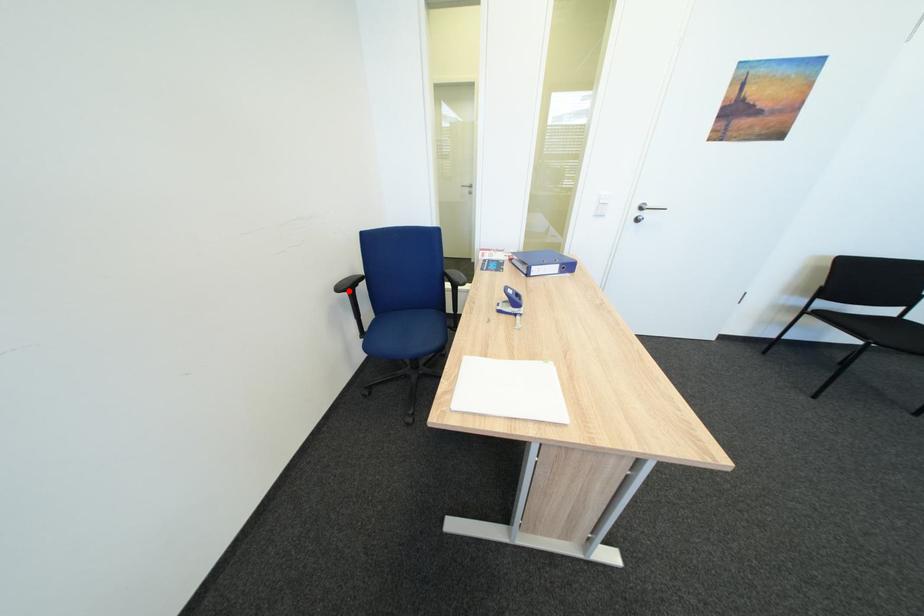
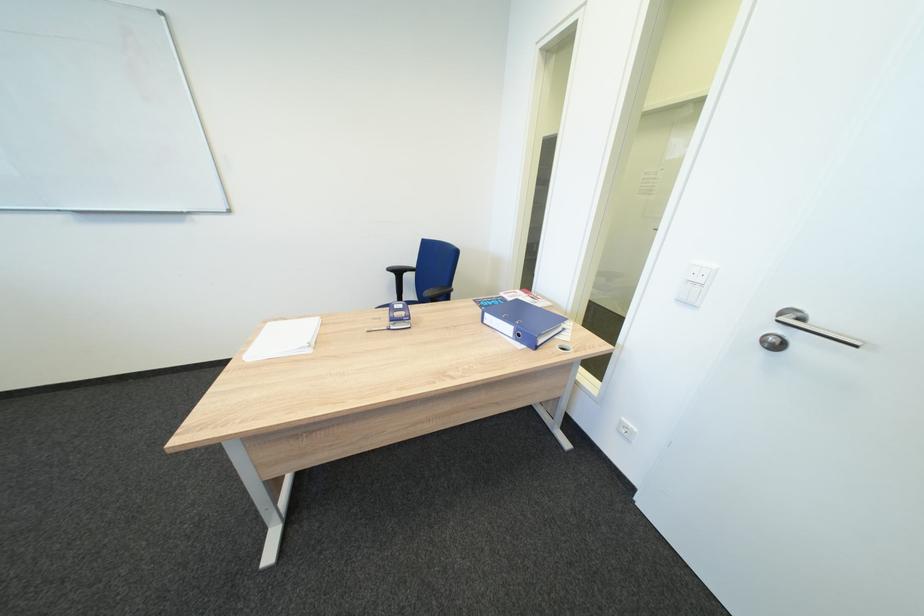
Find the pixel in the second image that matches the highlighted location in the first image.

(400, 270)